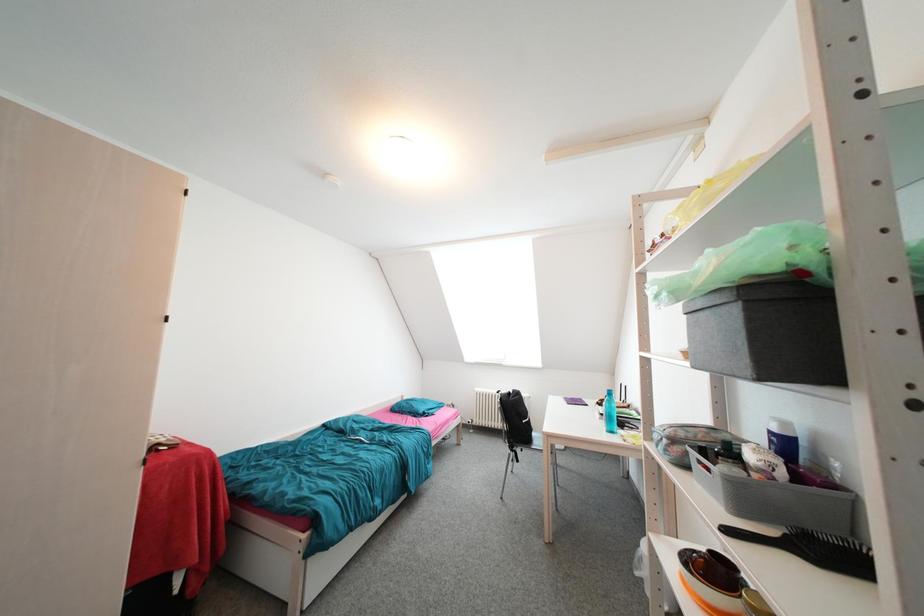
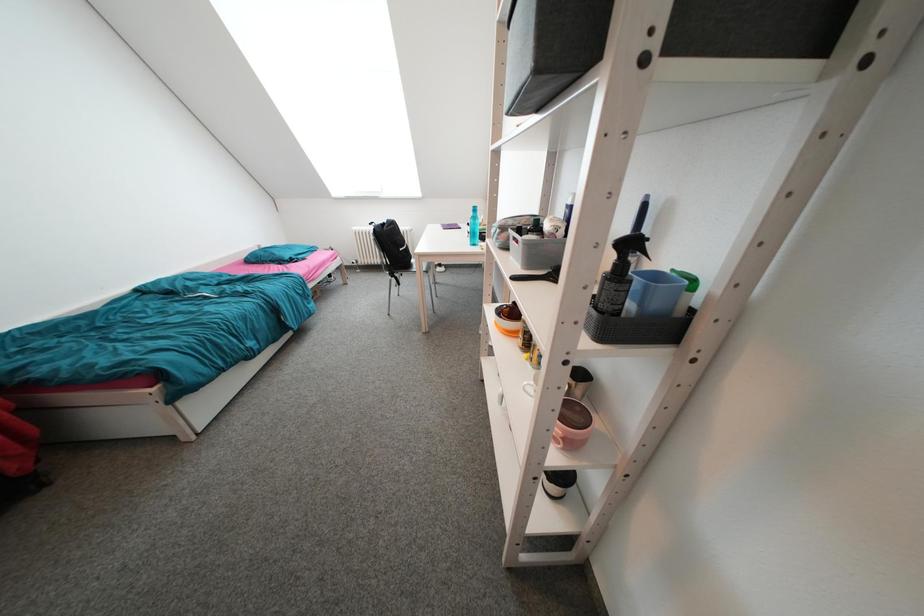
How did the camera likely rotate?

The rotation direction of the camera is right-down.